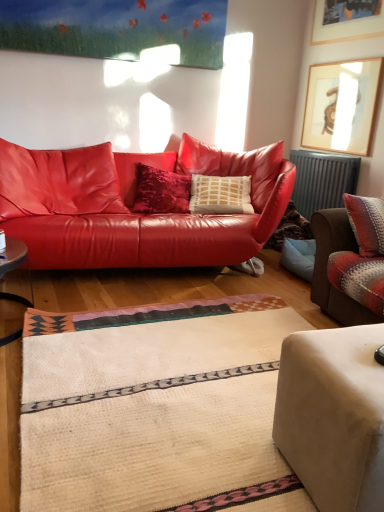
Describe the element at coordinates (333, 415) in the screenshot. I see `beige fabric ottoman at lower right, the first studio couch when ordered from front to back` at that location.

Describe the element at coordinates (326, 268) in the screenshot. This screenshot has height=512, width=384. I see `velvet brown armchair at right, placed as the second studio couch when sorted from back to front` at that location.

Locate an element on the screen. The width and height of the screenshot is (384, 512). wooden picture frame at upper right, positioned as the second picture frame in bottom-to-top order is located at coordinates (347, 21).

How much space does matte leather couch at center, which ranks as the first studio couch in back-to-front order, occupy horizontally?

matte leather couch at center, which ranks as the first studio couch in back-to-front order, is 4.33 feet wide.

What do you see at coordinates (132, 206) in the screenshot?
I see `matte leather couch at center, acting as the 3th studio couch starting from the front` at bounding box center [132, 206].

Identify the location of wooden framed artwork at upper right, the first picture frame when ordered from bottom to top. (341, 106).

What are the coordinates of `beige fabric ottoman at lower right, the first studio couch when ordered from front to back` in the screenshot? It's located at (333, 415).

Can you tell me how much beige fabric ottoman at lower right, the first studio couch when ordered from front to back, and metallic gray radiator at right differ in facing direction?

There is a 7.74-degree angle between the facing directions of beige fabric ottoman at lower right, the first studio couch when ordered from front to back, and metallic gray radiator at right.

Is beige fabric ottoman at lower right, acting as the 3th studio couch starting from the back, bigger than metallic gray radiator at right?

Yes, beige fabric ottoman at lower right, acting as the 3th studio couch starting from the back, is bigger than metallic gray radiator at right.

Which of these two, beige fabric ottoman at lower right, acting as the 3th studio couch starting from the back, or metallic gray radiator at right, is thinner?

metallic gray radiator at right is thinner.

The height and width of the screenshot is (512, 384). Identify the location of the 3rd studio couch positioned below the metallic gray radiator at right (from the image's perspective). pyautogui.click(x=333, y=415).

Is beige fabric ottoman at lower right, the first studio couch when ordered from front to back, further to the viewer compared to wooden picture frame at upper right, positioned as the second picture frame in bottom-to-top order?

No, the depth of beige fabric ottoman at lower right, the first studio couch when ordered from front to back, is less than that of wooden picture frame at upper right, positioned as the second picture frame in bottom-to-top order.

Could you tell me if beige fabric ottoman at lower right, the first studio couch when ordered from front to back, is turned towards wooden picture frame at upper right, positioned as the second picture frame in bottom-to-top order?

No, beige fabric ottoman at lower right, the first studio couch when ordered from front to back, is not aimed at wooden picture frame at upper right, positioned as the second picture frame in bottom-to-top order.

Locate an element on the screen. Image resolution: width=384 pixels, height=512 pixels. the 1st picture frame behind when counting from the beige fabric ottoman at lower right, acting as the 3th studio couch starting from the back is located at coordinates (347, 21).

From a real-world perspective, is beige fabric ottoman at lower right, acting as the 3th studio couch starting from the back, positioned under wooden picture frame at upper right, the 1th picture frame from the top, based on gravity?

Indeed, from a real-world perspective, beige fabric ottoman at lower right, acting as the 3th studio couch starting from the back, is positioned beneath wooden picture frame at upper right, the 1th picture frame from the top.

Can you confirm if metallic gray radiator at right is wider than wooden framed artwork at upper right, the first picture frame when ordered from bottom to top?

Indeed, metallic gray radiator at right has a greater width compared to wooden framed artwork at upper right, the first picture frame when ordered from bottom to top.

From a real-world perspective, which object rests below the other?

metallic gray radiator at right, from a real-world perspective.

From the image's perspective, which one is positioned higher, metallic gray radiator at right or wooden framed artwork at upper right, the first picture frame when ordered from bottom to top?

wooden framed artwork at upper right, the first picture frame when ordered from bottom to top, appears higher in the image.

Does point (317, 165) appear closer or farther from the camera than point (320, 147)?

Clearly, point (317, 165) is closer to the camera than point (320, 147).

From a real-world perspective, is matte leather couch at center, acting as the 3th studio couch starting from the front, beneath wooden picture frame at upper right, positioned as the second picture frame in bottom-to-top order?

Yes, from a real-world perspective, matte leather couch at center, acting as the 3th studio couch starting from the front, is below wooden picture frame at upper right, positioned as the second picture frame in bottom-to-top order.

Is matte leather couch at center, which ranks as the first studio couch in back-to-front order, looking in the opposite direction of wooden picture frame at upper right, positioned as the second picture frame in bottom-to-top order?

No, wooden picture frame at upper right, positioned as the second picture frame in bottom-to-top order, is not at the back of matte leather couch at center, which ranks as the first studio couch in back-to-front order.

Are matte leather couch at center, which ranks as the first studio couch in back-to-front order, and wooden picture frame at upper right, the 1th picture frame from the top, located far from each other?

Absolutely, matte leather couch at center, which ranks as the first studio couch in back-to-front order, is distant from wooden picture frame at upper right, the 1th picture frame from the top.

From the image's perspective, which is below, wooden framed artwork at upper right, the first picture frame when ordered from bottom to top, or velvet brown armchair at right, the second studio couch from the front?

velvet brown armchair at right, the second studio couch from the front, appears lower in the image.

Considering the relative sizes of wooden framed artwork at upper right, the first picture frame when ordered from bottom to top, and velvet brown armchair at right, placed as the second studio couch when sorted from back to front, in the image provided, is wooden framed artwork at upper right, the first picture frame when ordered from bottom to top, wider than velvet brown armchair at right, placed as the second studio couch when sorted from back to front,?

Incorrect, the width of wooden framed artwork at upper right, the first picture frame when ordered from bottom to top, does not surpass that of velvet brown armchair at right, placed as the second studio couch when sorted from back to front.

Is wooden framed artwork at upper right, the first picture frame when ordered from bottom to top, positioned far away from velvet brown armchair at right, placed as the second studio couch when sorted from back to front?

Indeed, wooden framed artwork at upper right, the first picture frame when ordered from bottom to top, is not near velvet brown armchair at right, placed as the second studio couch when sorted from back to front.

Where is `the 2nd studio couch positioned below the metallic gray radiator at right (from the image's perspective)`? the 2nd studio couch positioned below the metallic gray radiator at right (from the image's perspective) is located at coordinates (326, 268).

Consider the image. Considering the sizes of objects metallic gray radiator at right and velvet brown armchair at right, the second studio couch from the front, in the image provided, who is taller, metallic gray radiator at right or velvet brown armchair at right, the second studio couch from the front,?

metallic gray radiator at right is taller.

Is point (304, 180) positioned behind point (326, 301)?

Yes, point (304, 180) is farther from viewer.

From a real-world perspective, is metallic gray radiator at right located beneath velvet brown armchair at right, placed as the second studio couch when sorted from back to front?

Yes, from a real-world perspective, metallic gray radiator at right is beneath velvet brown armchair at right, placed as the second studio couch when sorted from back to front.

Considering the points (316, 185) and (216, 223), which point is behind, point (316, 185) or point (216, 223)?

The point (316, 185) is behind.

Is metallic gray radiator at right further to the viewer compared to matte leather couch at center, acting as the 3th studio couch starting from the front?

Yes, metallic gray radiator at right is behind matte leather couch at center, acting as the 3th studio couch starting from the front.

Based on the photo, considering the sizes of objects metallic gray radiator at right and matte leather couch at center, which ranks as the first studio couch in back-to-front order, in the image provided, who is bigger, metallic gray radiator at right or matte leather couch at center, which ranks as the first studio couch in back-to-front order,?

Bigger between the two is matte leather couch at center, which ranks as the first studio couch in back-to-front order.

Between metallic gray radiator at right and matte leather couch at center, acting as the 3th studio couch starting from the front, which one appears on the left side from the viewer's perspective?

matte leather couch at center, acting as the 3th studio couch starting from the front, is more to the left.

Where is `radiator that appears above the beige fabric ottoman at lower right, the first studio couch when ordered from front to back (from the image's perspective)`? radiator that appears above the beige fabric ottoman at lower right, the first studio couch when ordered from front to back (from the image's perspective) is located at coordinates pos(322,180).

Where is `studio couch that is the 3rd object located in front of the wooden picture frame at upper right, the 1th picture frame from the top`? The width and height of the screenshot is (384, 512). studio couch that is the 3rd object located in front of the wooden picture frame at upper right, the 1th picture frame from the top is located at coordinates (333, 415).

Considering their positions, is metallic gray radiator at right positioned further to velvet brown armchair at right, placed as the second studio couch when sorted from back to front, than wooden picture frame at upper right, the 1th picture frame from the top?

wooden picture frame at upper right, the 1th picture frame from the top.

Which object lies further to the anchor point velvet brown armchair at right, placed as the second studio couch when sorted from back to front, wooden framed artwork at upper right, the first picture frame when ordered from bottom to top, or metallic gray radiator at right?

Based on the image, wooden framed artwork at upper right, the first picture frame when ordered from bottom to top, appears to be further to velvet brown armchair at right, placed as the second studio couch when sorted from back to front.

Looking at the image, which one is located further to matte leather couch at center, acting as the 3th studio couch starting from the front, velvet brown armchair at right, placed as the second studio couch when sorted from back to front, or metallic gray radiator at right?

metallic gray radiator at right.

Based on their spatial positions, is matte leather couch at center, which ranks as the first studio couch in back-to-front order, or beige fabric ottoman at lower right, the first studio couch when ordered from front to back, further from wooden picture frame at upper right, the 1th picture frame from the top?

Based on the image, beige fabric ottoman at lower right, the first studio couch when ordered from front to back, appears to be further to wooden picture frame at upper right, the 1th picture frame from the top.

From the image, which object appears to be nearer to beige fabric ottoman at lower right, the first studio couch when ordered from front to back, wooden picture frame at upper right, the 1th picture frame from the top, or velvet brown armchair at right, the second studio couch from the front?

Among the two, velvet brown armchair at right, the second studio couch from the front, is located nearer to beige fabric ottoman at lower right, the first studio couch when ordered from front to back.

Based on their spatial positions, is beige fabric ottoman at lower right, the first studio couch when ordered from front to back, or wooden framed artwork at upper right, the first picture frame when ordered from bottom to top, further from metallic gray radiator at right?

The object further to metallic gray radiator at right is beige fabric ottoman at lower right, the first studio couch when ordered from front to back.

Based on their spatial positions, is beige fabric ottoman at lower right, acting as the 3th studio couch starting from the back, or wooden framed artwork at upper right, the first picture frame when ordered from bottom to top, closer to matte leather couch at center, which ranks as the first studio couch in back-to-front order?

Among the two, wooden framed artwork at upper right, the first picture frame when ordered from bottom to top, is located nearer to matte leather couch at center, which ranks as the first studio couch in back-to-front order.

Based on their spatial positions, is wooden framed artwork at upper right, which is counted as the second picture frame, starting from the top, or matte leather couch at center, acting as the 3th studio couch starting from the front, closer to beige fabric ottoman at lower right, the first studio couch when ordered from front to back?

The object closer to beige fabric ottoman at lower right, the first studio couch when ordered from front to back, is matte leather couch at center, acting as the 3th studio couch starting from the front.

Identify the location of studio couch between wooden picture frame at upper right, the 1th picture frame from the top, and velvet brown armchair at right, the second studio couch from the front, from top to bottom. (132, 206).

At what (x,y) coordinates should I click in order to perform the action: click on picture frame between wooden picture frame at upper right, the 1th picture frame from the top, and metallic gray radiator at right, in the vertical direction. Please return your answer as a coordinate pair (x, y). Looking at the image, I should click on (341, 106).

Locate an element on the screen. radiator between matte leather couch at center, which ranks as the first studio couch in back-to-front order, and wooden picture frame at upper right, positioned as the second picture frame in bottom-to-top order is located at coordinates pos(322,180).

Locate an element on the screen. This screenshot has width=384, height=512. studio couch between matte leather couch at center, acting as the 3th studio couch starting from the front, and velvet brown armchair at right, the second studio couch from the front, in the horizontal direction is located at coordinates (333, 415).